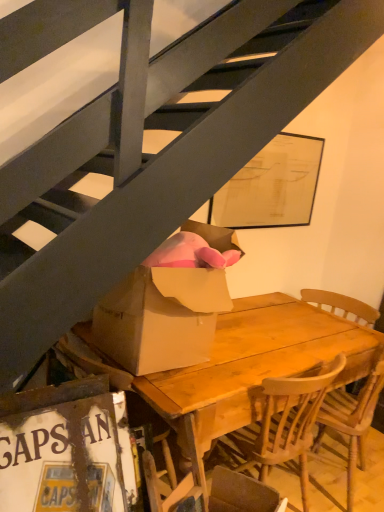
This screenshot has width=384, height=512. Identify the location of white cardboard sign at lower left. (66, 449).

Find the location of `wooden chair at center`. wooden chair at center is located at coordinates (342, 305).

This screenshot has height=512, width=384. What do you see at coordinates (342, 305) in the screenshot?
I see `wooden chair at center` at bounding box center [342, 305].

Locate an element on the screen. The height and width of the screenshot is (512, 384). white cardboard sign at lower left is located at coordinates (66, 449).

Could you tell me if white cardboard sign at lower left is turned towards wooden chair at center?

No, white cardboard sign at lower left is not oriented towards wooden chair at center.

I want to click on picture frame above the wooden chair at center (from a real-world perspective), so click(x=66, y=449).

Is the position of white cardboard sign at lower left more distant than that of wooden chair at center?

No, white cardboard sign at lower left is in front of wooden chair at center.

Between brown cardboard box at center and wooden chair at center, which one has smaller size?

With smaller size is brown cardboard box at center.

Would you consider brown cardboard box at center to be distant from wooden chair at center?

brown cardboard box at center is far away from wooden chair at center.

Which object is positioned more to the left, brown cardboard box at center or wooden chair at center?

Positioned to the left is brown cardboard box at center.

Based on the photo, from a real-world perspective, is brown cardboard box at center physically below wooden chair at center?

Incorrect, from a real-world perspective, brown cardboard box at center is higher than wooden chair at center.

Between wooden chair at center and wooden table at center, which one appears on the left side from the viewer's perspective?

From the viewer's perspective, wooden table at center appears more on the left side.

In the scene shown: Is wooden chair at center situated inside wooden table at center or outside?

wooden chair at center is located inside wooden table at center.

Is wooden chair at center looking in the opposite direction of wooden table at center?

Yes.

Is wooden chair at center in front of or behind wooden table at center in the image?

Clearly, wooden chair at center is behind wooden table at center.

I want to click on chair below the brown cardboard box at center (from the image's perspective), so click(x=342, y=305).

Is wooden chair at center to the left or to the right of brown cardboard box at center in the image?

Based on their positions, wooden chair at center is located to the right of brown cardboard box at center.

Is wooden chair at center in front of or behind brown cardboard box at center in the image?

Visually, wooden chair at center is located behind brown cardboard box at center.

Who is smaller, wooden chair at center or brown cardboard box at center?

With smaller size is brown cardboard box at center.

Can you confirm if white cardboard sign at lower left is positioned to the left of wooden table at center?

Yes, white cardboard sign at lower left is to the left of wooden table at center.

Which is correct: white cardboard sign at lower left is inside wooden table at center, or outside of it?

white cardboard sign at lower left is not inside wooden table at center, it's outside.

From the image's perspective, would you say white cardboard sign at lower left is positioned over wooden table at center?

Incorrect, from the image's perspective, white cardboard sign at lower left is lower than wooden table at center.

Based on the photo, from a real-world perspective, which object rests below the other?

wooden table at center.

Considering their positions, is white cardboard sign at lower left located in front of or behind brown cardboard box at center?

In the image, white cardboard sign at lower left appears in front of brown cardboard box at center.

Between white cardboard sign at lower left and brown cardboard box at center, which one has smaller size?

white cardboard sign at lower left is smaller.

Does point (29, 429) appear closer or farther from the camera than point (167, 307)?

Point (29, 429) is positioned closer to the camera compared to point (167, 307).

How much distance is there between wooden table at center and brown cardboard box at center?

wooden table at center and brown cardboard box at center are 15.41 inches apart from each other.

Does point (254, 336) come farther from viewer compared to point (154, 277)?

That is True.

From the image's perspective, does wooden table at center appear higher than brown cardboard box at center?

Actually, wooden table at center appears below brown cardboard box at center in the image.

In the image, there is a wooden chair at center. What are the coordinates of `picture frame below it (from the image's perspective)` in the screenshot? It's located at tap(66, 449).

Locate an element on the screen. This screenshot has width=384, height=512. chair located on the right of brown cardboard box at center is located at coordinates (342, 305).

Estimate the real-world distances between objects in this image. Which object is closer to brown cardboard box at center, wooden table at center or white cardboard sign at lower left?

The object closer to brown cardboard box at center is white cardboard sign at lower left.

Looking at the image, which one is located closer to wooden chair at center, brown cardboard box at center or white cardboard sign at lower left?

Based on the image, brown cardboard box at center appears to be nearer to wooden chair at center.

When comparing their distances from wooden table at center, does brown cardboard box at center or wooden chair at center seem closer?

brown cardboard box at center.

Looking at the image, which one is located further to white cardboard sign at lower left, wooden table at center or wooden chair at center?

wooden chair at center.

Looking at the image, which one is located further to wooden chair at center, brown cardboard box at center or wooden table at center?

brown cardboard box at center is positioned further to the anchor wooden chair at center.

From the image, which object appears to be nearer to brown cardboard box at center, wooden chair at center or white cardboard sign at lower left?

Among the two, white cardboard sign at lower left is located nearer to brown cardboard box at center.

From the image, which object appears to be nearer to white cardboard sign at lower left, wooden chair at center or brown cardboard box at center?

Among the two, brown cardboard box at center is located nearer to white cardboard sign at lower left.

From the image, which object appears to be farther from wooden table at center, white cardboard sign at lower left or wooden chair at center?

Based on the image, wooden chair at center appears to be further to wooden table at center.

The image size is (384, 512). I want to click on desk located between white cardboard sign at lower left and wooden chair at center in the depth direction, so click(253, 367).

This screenshot has height=512, width=384. I want to click on box located between white cardboard sign at lower left and wooden chair at center in the left-right direction, so pos(161,318).

Locate an element on the screen. The width and height of the screenshot is (384, 512). desk between brown cardboard box at center and wooden chair at center in the front-back direction is located at coordinates (253, 367).

This screenshot has height=512, width=384. What are the coordinates of `desk between brown cardboard box at center and white cardboard sign at lower left in the up-down direction` in the screenshot? It's located at (253, 367).